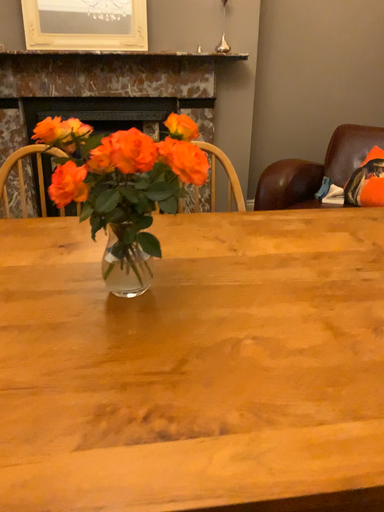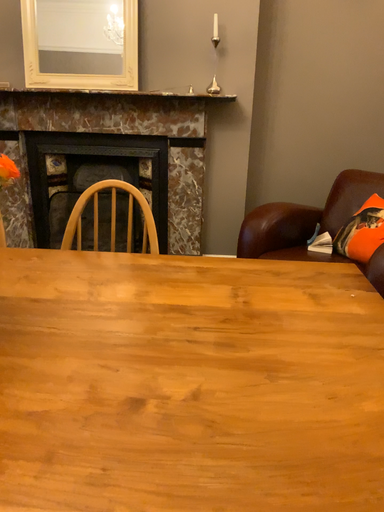
Question: Which way did the camera rotate in the video?

Choices:
 (A) rotated left
 (B) rotated right

Answer: (A)